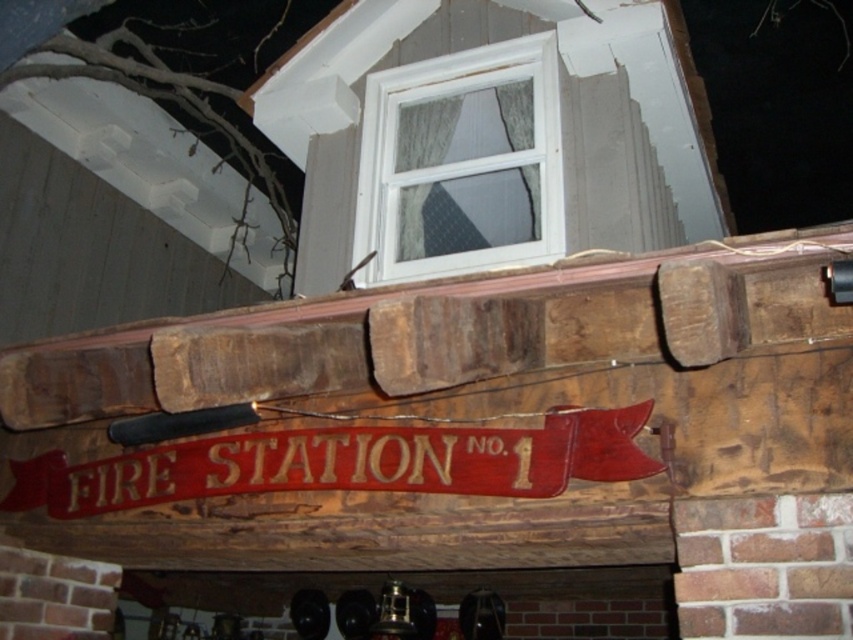
Question: Does rustic wood beam at center have a lesser width compared to white plastic window at upper center?

Choices:
 (A) no
 (B) yes

Answer: (A)

Question: Which point is farther to the camera?

Choices:
 (A) (438, 198)
 (B) (637, 304)

Answer: (A)

Question: Can you confirm if rustic wood beam at center is wider than white plastic window at upper center?

Choices:
 (A) no
 (B) yes

Answer: (B)

Question: Which point appears closest to the camera in this image?

Choices:
 (A) (320, 300)
 (B) (518, 184)

Answer: (A)

Question: Considering the relative positions of rustic wood beam at center and white plastic window at upper center in the image provided, where is rustic wood beam at center located with respect to white plastic window at upper center?

Choices:
 (A) left
 (B) right

Answer: (A)